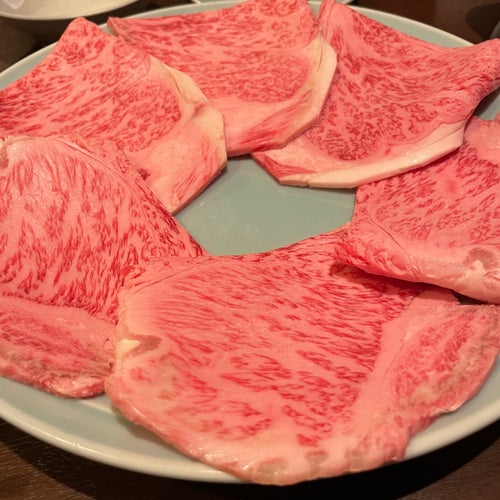
Image resolution: width=500 pixels, height=500 pixels. Find the location of `center of plate that has no food on top`. center of plate that has no food on top is located at coordinates (242, 222).